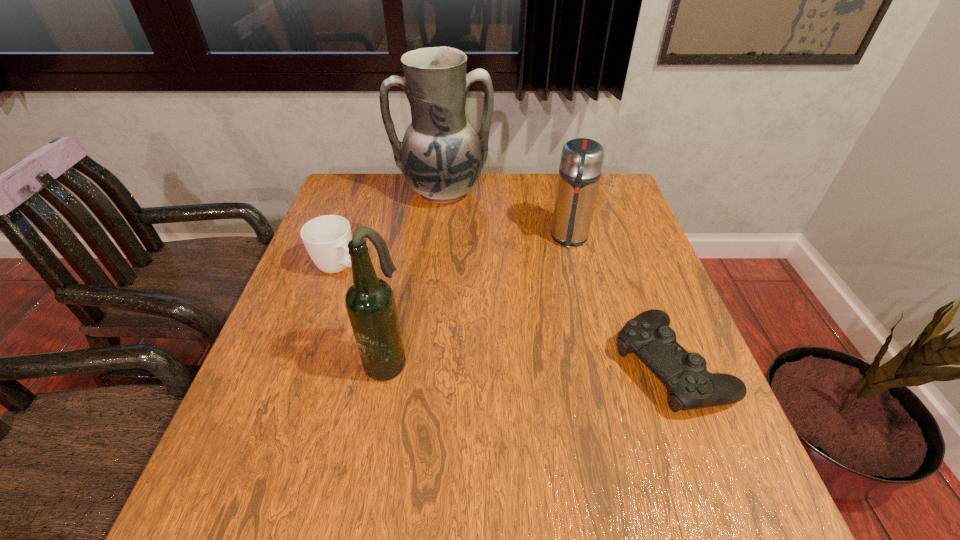
This screenshot has width=960, height=540. Identify the location of the second tallest object. (370, 303).

Where is `the shortest object`? The width and height of the screenshot is (960, 540). the shortest object is located at coordinates (648, 335).

This screenshot has width=960, height=540. In order to click on thermos bottle in this screenshot , I will do `click(581, 163)`.

This screenshot has width=960, height=540. In order to click on the fourth tallest object in this screenshot , I will do `click(326, 238)`.

This screenshot has width=960, height=540. In order to click on the leftmost object in this screenshot , I will do `click(326, 238)`.

Locate an element on the screen. the farthest object is located at coordinates (441, 157).

You are a GUI agent. You are given a task and a screenshot of the screen. Output one action in this format:
    pyautogui.click(x=<x>, y=<y>)
    Task: Click on the pitcher
    
    Given the screenshot: What is the action you would take?
    pyautogui.click(x=441, y=157)

You are a GUI agent. You are given a task and a screenshot of the screen. Output one action in this format:
    pyautogui.click(x=<x>, y=<y>)
    Task: Click on the vacant point located on the back of the fourth shortest object
    Image resolution: width=960 pixels, height=540 pixels.
    Given the screenshot: What is the action you would take?
    point(405,260)

Identify the location of free spot located on the back of the control. (623, 239).

Where is `free point located 0.060m with a handle on the side of the thermos bottle`? Image resolution: width=960 pixels, height=540 pixels. free point located 0.060m with a handle on the side of the thermos bottle is located at coordinates (567, 267).